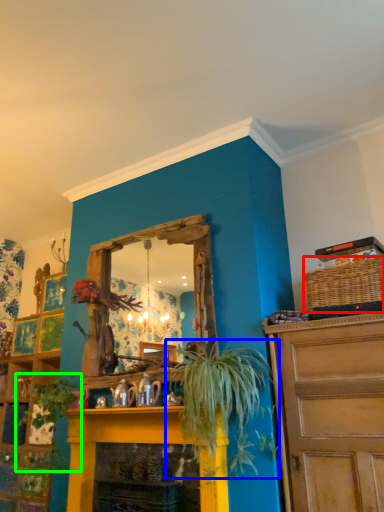
Question: Based on their relative distances, which object is nearer to basket (highlighted by a red box)? Choose from houseplant (highlighted by a blue box) and plant (highlighted by a green box).

Choices:
 (A) houseplant
 (B) plant

Answer: (A)